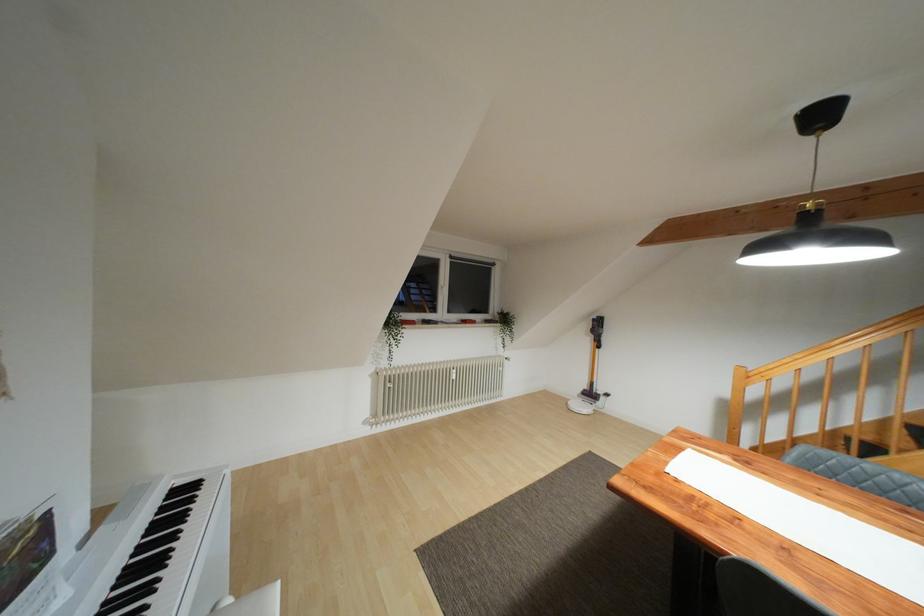
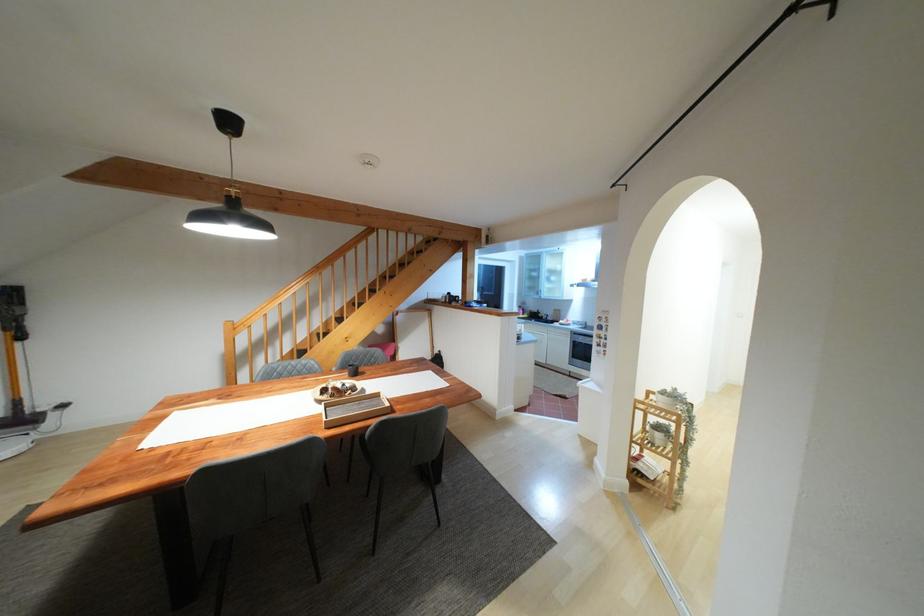
Question: The camera is either moving clockwise (left) or counter-clockwise (right) around the object. The first image is from the beginning of the video and the second image is from the end. Is the camera moving left or right when shooting the video?

Choices:
 (A) Left
 (B) Right

Answer: (A)